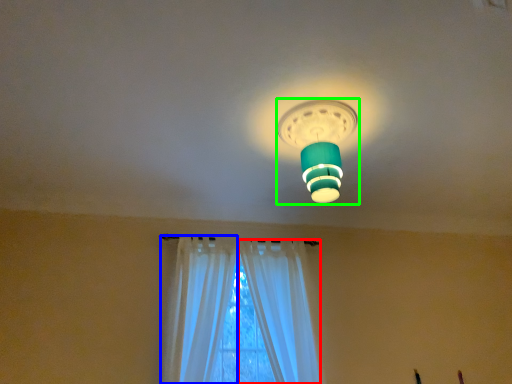
Question: Based on their relative distances, which object is farther from curtain (highlighted by a red box)? Choose from curtain (highlighted by a blue box) and lamp (highlighted by a green box).

Choices:
 (A) curtain
 (B) lamp

Answer: (B)